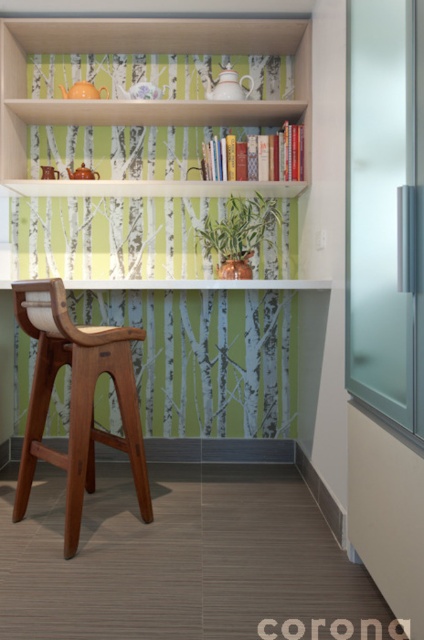
You are standing in the room shown in the image. There is a point marked at coordinates (x=323, y=259). Based on the scene description, what object is located at that point?

The point at coordinates (x=323, y=259) indicates the matte wood bookcase at upper center.

You are sitting on the mahogany wood chair at center and want to reach the white wood shelf at upper center. Is the shelf to your left or right side?

The white wood shelf at upper center is positioned on the right side of the mahogany wood chair at center, so it would be to your right side.

Consider the image. You are standing in the room looking at the shelving unit. There are two points marked on the shelves. Which point, point (242, 13) or point (153, 35), is closer to you?

Point (242, 13) is closer to the viewer than point (153, 35).